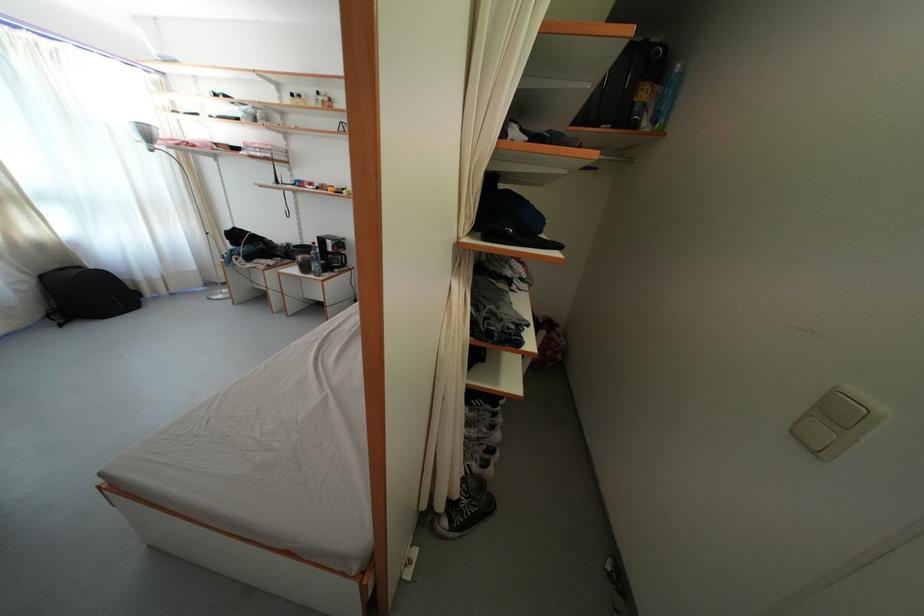
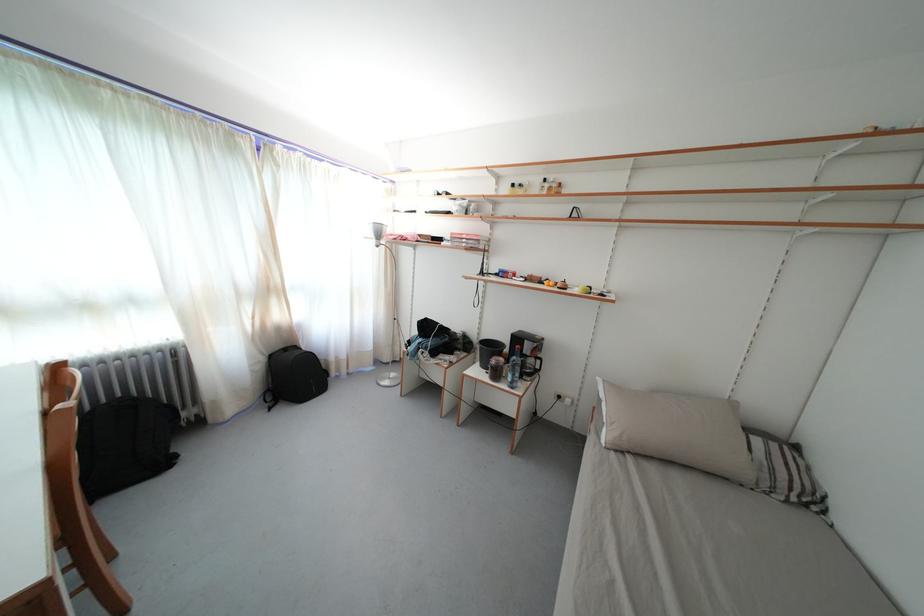
Where in the second image is the point corresponding to (298,100) from the first image?

(518, 191)